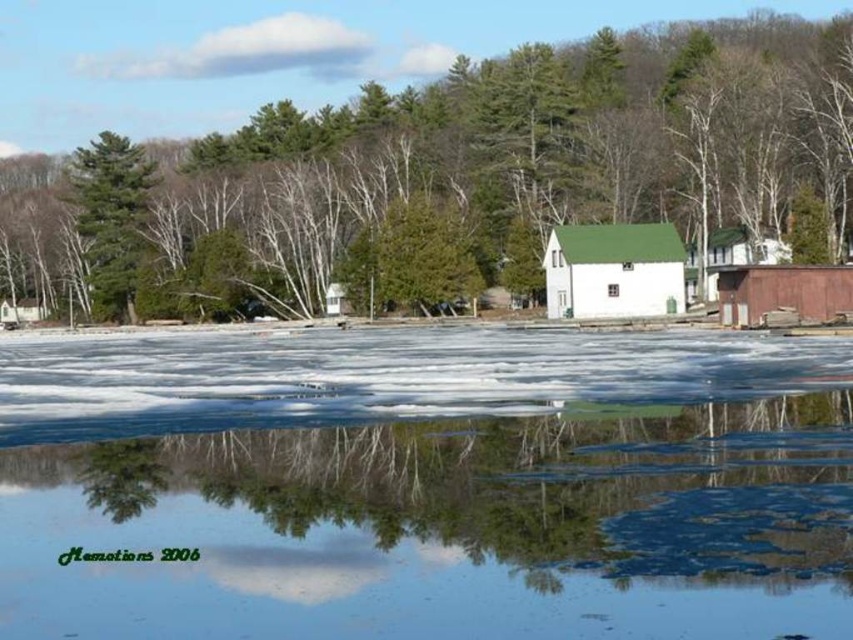
Based on the scene description, which object is larger in size between the green leafy tree at center and the white wood barn at center?

The green leafy tree at center is bigger than the white wood barn at center according to the description.

You are an ice skater planning to glide from the green textured pine tree at left to the translucent ice at center. Based on the scene description, which direction should you move relative to the tree?

You should move to the right relative to the green textured pine tree at left because the translucent ice at center is positioned on the right side of the green textured pine tree at left.